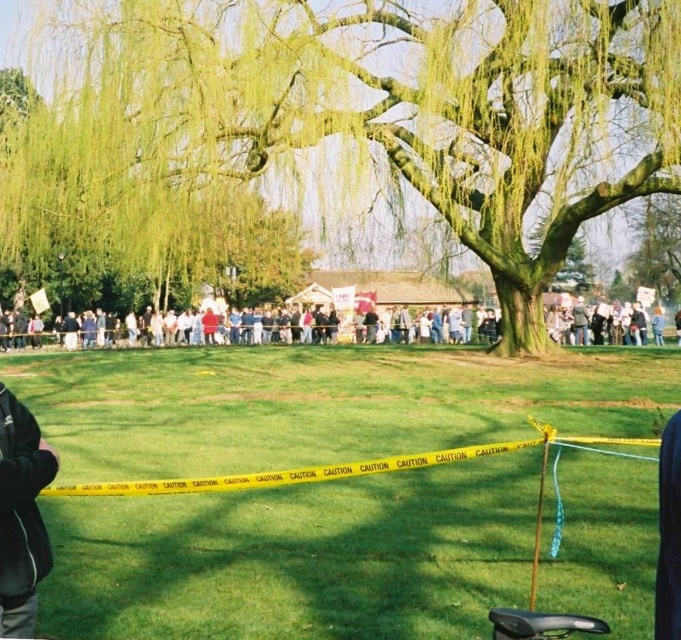
Question: Which point appears farthest from the camera in this image?

Choices:
 (A) (104, 195)
 (B) (481, 224)
 (C) (0, 540)

Answer: (B)

Question: Which object is positioned closest to the green leafy tree at center?

Choices:
 (A) dark gray fleece jacket at left
 (B) green leafy tree at upper center

Answer: (B)

Question: Is green leafy tree at upper center further to camera compared to multicolored fabric crowd at center?

Choices:
 (A) yes
 (B) no

Answer: (B)

Question: Is green leafy tree at center wider than dark gray fleece jacket at left?

Choices:
 (A) no
 (B) yes

Answer: (B)

Question: Is the position of green leafy tree at center more distant than that of multicolored fabric crowd at center?

Choices:
 (A) no
 (B) yes

Answer: (A)

Question: Which object is farther from the camera taking this photo?

Choices:
 (A) green leafy tree at center
 (B) green leafy tree at upper center
 (C) multicolored fabric crowd at center
 (D) dark gray fleece jacket at left

Answer: (C)